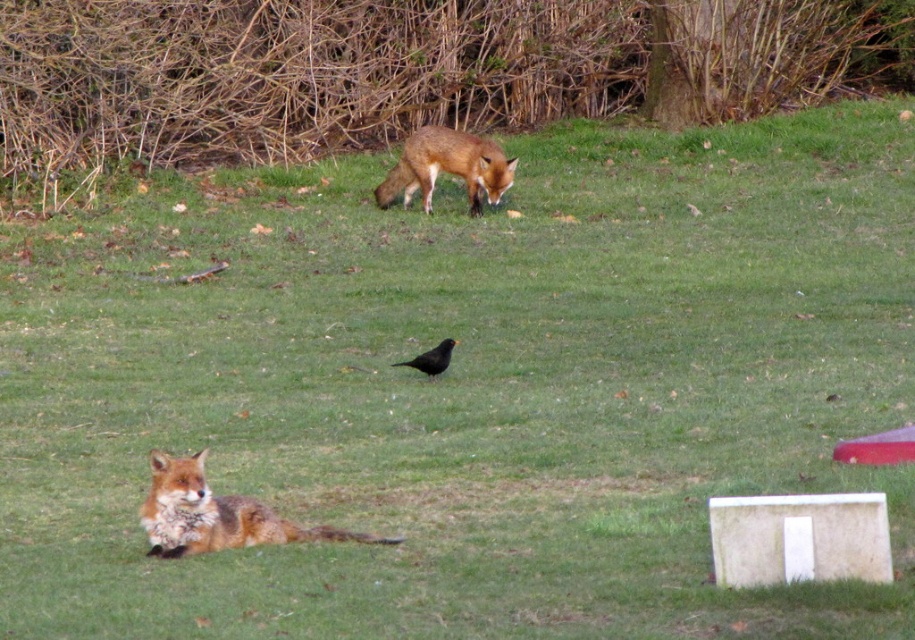
Question: Can you confirm if orange fur fox at upper center is positioned to the right of black matte bird at center?

Choices:
 (A) no
 (B) yes

Answer: (B)

Question: Based on their relative distances, which object is nearer to the orange fur fox at lower left?

Choices:
 (A) black matte bird at center
 (B) orange fur fox at upper center

Answer: (A)

Question: Is the position of orange fur fox at upper center more distant than that of black matte bird at center?

Choices:
 (A) yes
 (B) no

Answer: (A)

Question: Which object appears farthest from the camera in this image?

Choices:
 (A) orange fur fox at upper center
 (B) orange fur fox at lower left
 (C) black matte bird at center

Answer: (A)

Question: Can you confirm if orange fur fox at lower left is positioned above black matte bird at center?

Choices:
 (A) yes
 (B) no

Answer: (B)

Question: Which of these objects is positioned farthest from the orange fur fox at upper center?

Choices:
 (A) black matte bird at center
 (B) orange fur fox at lower left

Answer: (B)